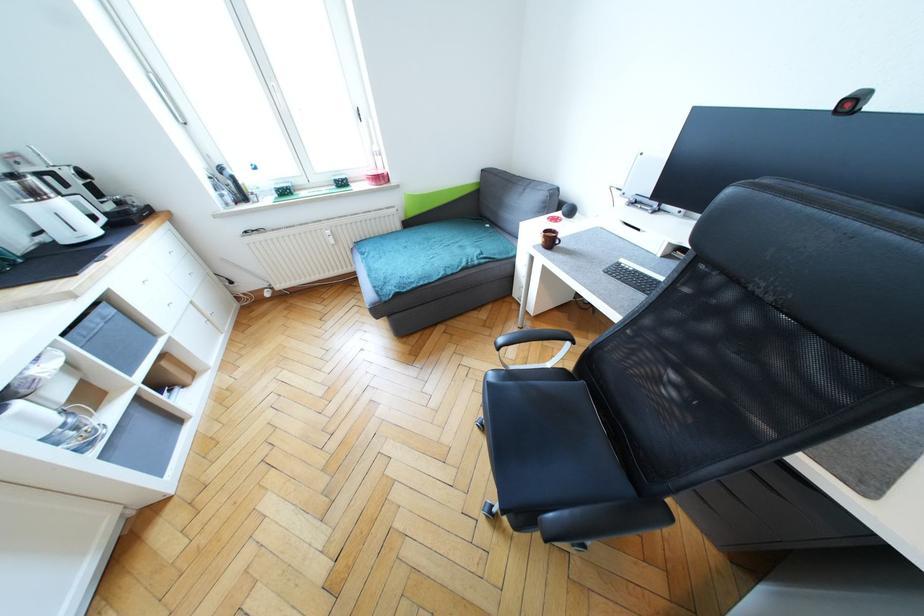
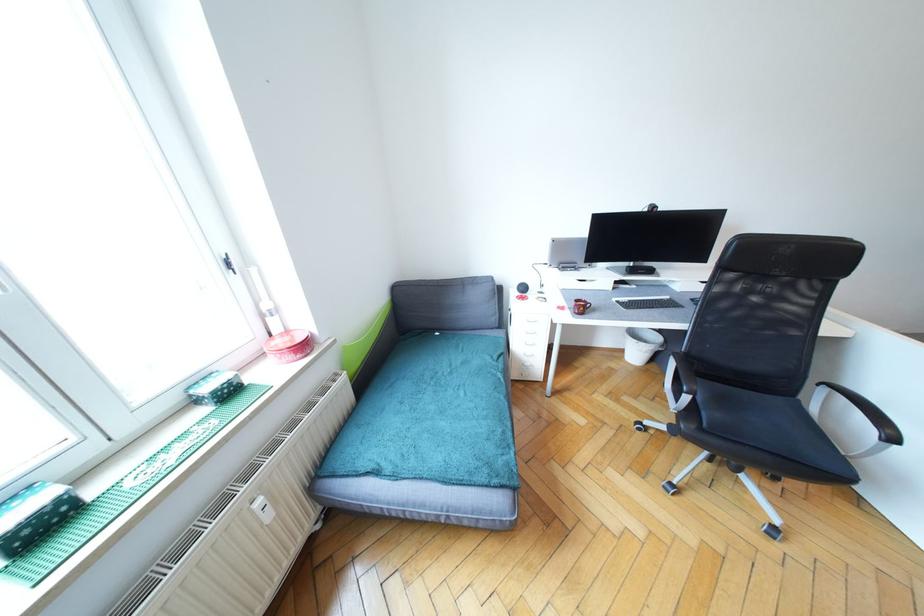
In the second image, find the point that corresponds to pixel 338 182 in the first image.

(217, 392)